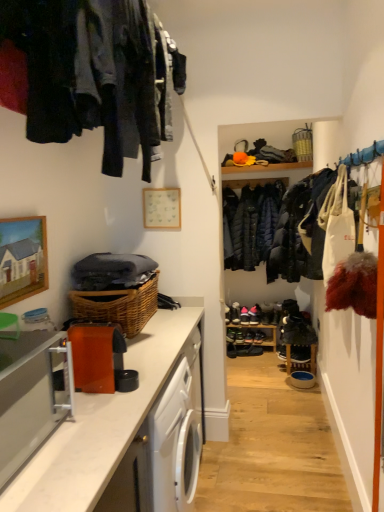
Question: Is woven brown basket at lower left, which appears as the first basket when viewed from the front, inside shiny black shoe at center, marked as the fourth shoe in a bottom-to-top arrangement?

Choices:
 (A) yes
 (B) no

Answer: (B)

Question: Is shiny black shoe at center, marked as the fourth shoe in a bottom-to-top arrangement, outside of woven brown basket at lower left, which appears as the first basket when viewed from the front?

Choices:
 (A) yes
 (B) no

Answer: (A)

Question: From a real-world perspective, does shiny black shoe at center, marked as the fourth shoe in a bottom-to-top arrangement, stand above woven brown basket at lower left, which appears as the second basket when viewed from the back?

Choices:
 (A) yes
 (B) no

Answer: (B)

Question: Is shiny black shoe at center, marked as the fourth shoe in a bottom-to-top arrangement, facing away from woven brown basket at lower left, placed as the 1th basket when sorted from left to right?

Choices:
 (A) yes
 (B) no

Answer: (B)

Question: Can you confirm if shiny black shoe at center, marked as the 3th shoe in a top-to-bottom arrangement, is positioned to the left of woven brown basket at lower left, which ranks as the 2th basket in top-to-bottom order?

Choices:
 (A) yes
 (B) no

Answer: (B)

Question: Looking at the image, does black leather shoes at center seem bigger or smaller compared to white matte picture frame at upper center, which is counted as the second picture frame, starting from the front?

Choices:
 (A) big
 (B) small

Answer: (A)

Question: Is black leather shoes at center situated inside white matte picture frame at upper center, which is counted as the second picture frame, starting from the front, or outside?

Choices:
 (A) inside
 (B) outside

Answer: (B)

Question: From a real-world perspective, is black leather shoes at center positioned above or below white matte picture frame at upper center, the second picture frame from the bottom?

Choices:
 (A) below
 (B) above

Answer: (A)

Question: Is point (231, 350) closer or farther from the camera than point (162, 217)?

Choices:
 (A) farther
 (B) closer

Answer: (A)

Question: From the image's perspective, is shiny black shoe at center, the 2th shoe in the top-to-bottom sequence, above or below shiny black shoe at center, marked as the 5th shoe in a top-to-bottom arrangement?

Choices:
 (A) below
 (B) above

Answer: (B)

Question: Is shiny black shoe at center, acting as the 5th shoe starting from the bottom, inside the boundaries of shiny black shoe at center, marked as the 5th shoe in a top-to-bottom arrangement, or outside?

Choices:
 (A) outside
 (B) inside

Answer: (A)

Question: In the image, is shiny black shoe at center, the 2th shoe in the top-to-bottom sequence, on the left side or the right side of shiny black shoe at center, marked as the 5th shoe in a top-to-bottom arrangement?

Choices:
 (A) right
 (B) left

Answer: (A)

Question: Considering the positions of shiny black shoe at center, acting as the 5th shoe starting from the bottom, and shiny black shoe at center, marked as the 5th shoe in a top-to-bottom arrangement, in the image, is shiny black shoe at center, acting as the 5th shoe starting from the bottom, bigger or smaller than shiny black shoe at center, marked as the 5th shoe in a top-to-bottom arrangement,?

Choices:
 (A) small
 (B) big

Answer: (B)

Question: In terms of width, does satin silver toaster at left look wider or thinner when compared to white matte picture frame at upper center, positioned as the 1th picture frame in top-to-bottom order?

Choices:
 (A) wide
 (B) thin

Answer: (A)

Question: In the image, is satin silver toaster at left positioned in front of or behind white matte picture frame at upper center, acting as the 1th picture frame starting from the right?

Choices:
 (A) front
 (B) behind

Answer: (A)